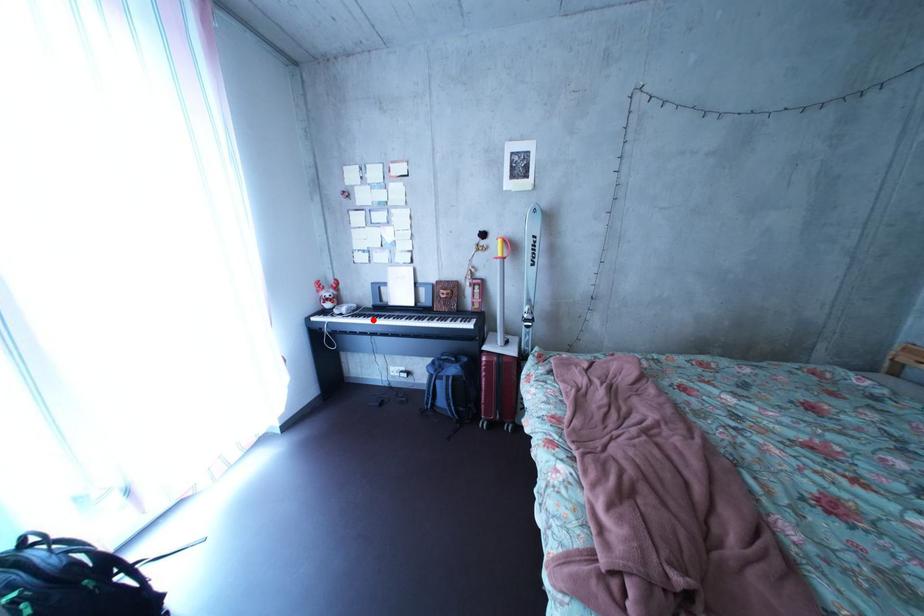
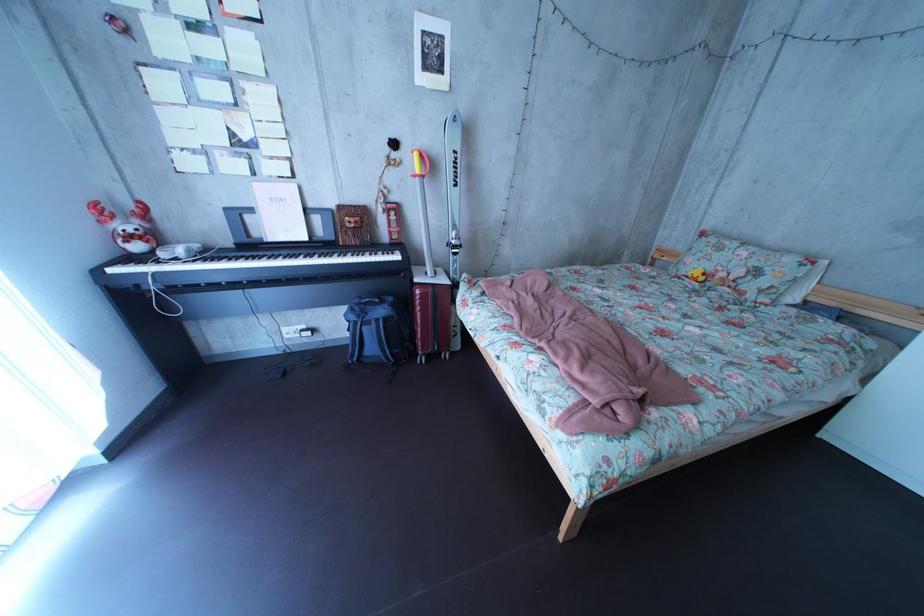
Find the pixel in the second image that matches the highlighted location in the first image.

(225, 262)